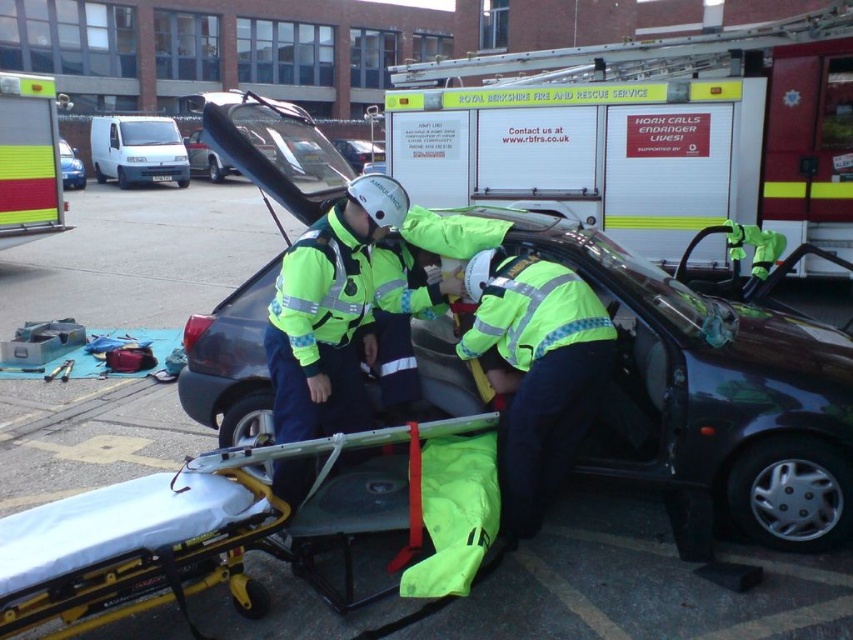
Question: Can you confirm if yellow metallic stretcher at lower left is positioned to the right of blue matte car at left?

Choices:
 (A) yes
 (B) no

Answer: (A)

Question: Among these objects, which one is farthest from the camera?

Choices:
 (A) dark gray metallic car at center
 (B) neon green fabric at lower right
 (C) yellow reflective ambulance at center
 (D) blue matte car at left

Answer: (D)

Question: Considering the real-world distances, which object is farthest from the neon yellow reflective jacket at center?

Choices:
 (A) dark gray metallic car at center
 (B) neon green fabric at lower right
 (C) yellow reflective barrier at left
 (D) white matte van at upper left

Answer: (D)

Question: Estimate the real-world distances between objects in this image. Which object is closer to the neon green fabric at lower right?

Choices:
 (A) neon yellow reflective uniform at center
 (B) white matte van at upper left
 (C) neon yellow reflective jacket at center

Answer: (A)

Question: Does yellow metallic stretcher at lower left appear on the right side of neon yellow reflective uniform at center?

Choices:
 (A) yes
 (B) no

Answer: (B)

Question: Is dark gray metallic car at center wider than white matte van at upper left?

Choices:
 (A) no
 (B) yes

Answer: (A)